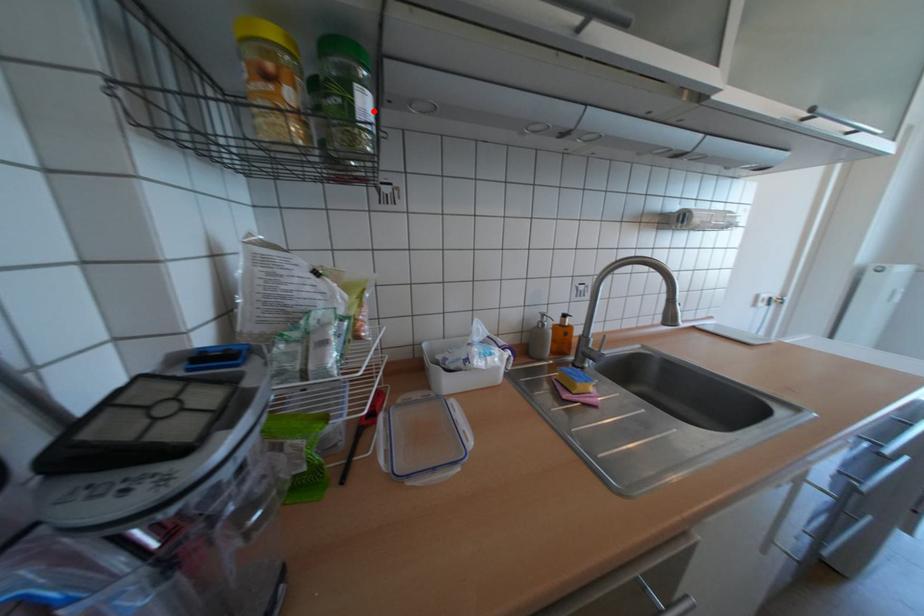
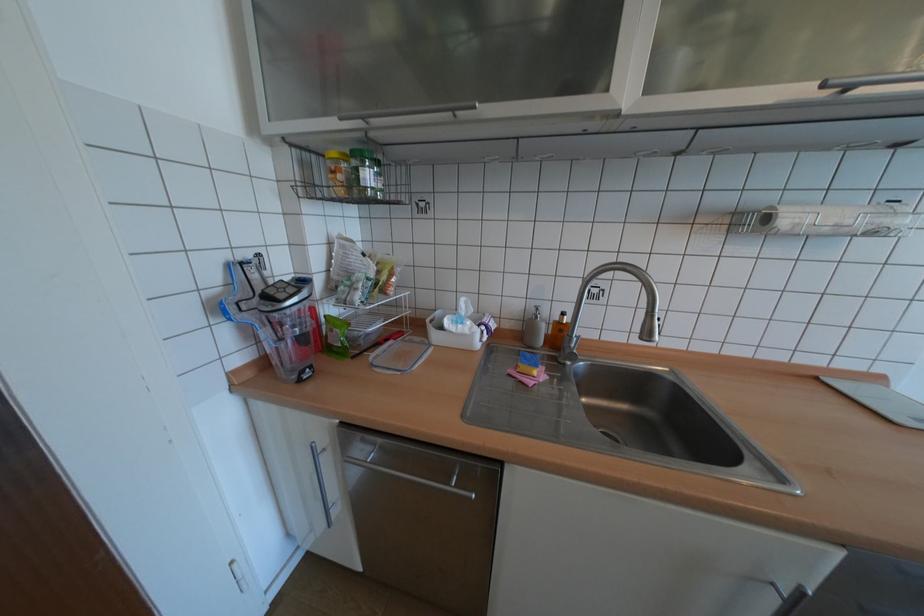
The point at the highlighted location is marked in the first image. Where is the corresponding point in the second image?

(373, 179)